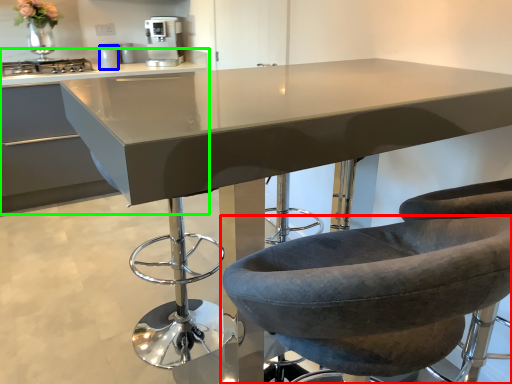
Question: Which is farther away from chair (highlighted by a red box)? appliance (highlighted by a blue box) or cabinetry (highlighted by a green box)?

Choices:
 (A) appliance
 (B) cabinetry

Answer: (A)